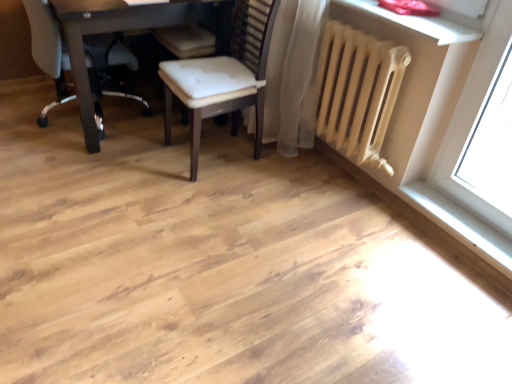
Locate an element on the screen. The image size is (512, 384). free space in front of wooden chair at center, which is the 2th chair in left-to-right order is located at coordinates (209, 200).